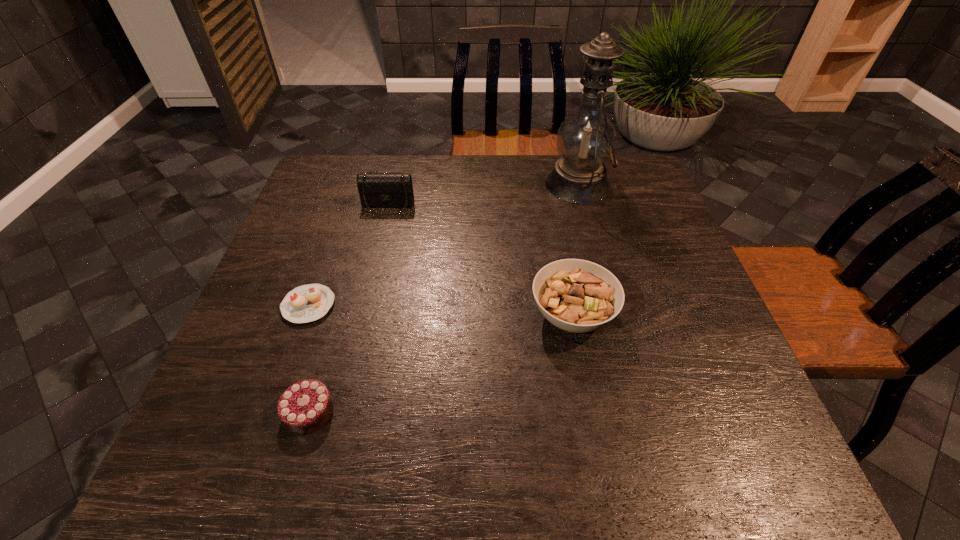
In the image, there is a desktop. Where is `free space at the near edge`? free space at the near edge is located at coordinates (414, 467).

Where is `vacant space at the left edge of the desktop`? This screenshot has width=960, height=540. vacant space at the left edge of the desktop is located at coordinates (253, 373).

Where is `vacant area at the right edge`? Image resolution: width=960 pixels, height=540 pixels. vacant area at the right edge is located at coordinates (639, 231).

The width and height of the screenshot is (960, 540). What are the coordinates of `vacant space at the far right corner of the desktop` in the screenshot? It's located at (647, 178).

Identify the location of blank region between the shortest object and the stew. Image resolution: width=960 pixels, height=540 pixels. [x=441, y=310].

Locate an element on the screen. The height and width of the screenshot is (540, 960). vacant area that lies between the cupcake and the clutch bag is located at coordinates (348, 255).

Where is `vacant space that's between the stew and the oil lamp`? vacant space that's between the stew and the oil lamp is located at coordinates (575, 250).

Find the location of a particular element. This screenshot has height=540, width=960. vacant point located between the shortest object and the nearest object is located at coordinates (309, 359).

Image resolution: width=960 pixels, height=540 pixels. I want to click on unoccupied area between the clutch bag and the tallest object, so [483, 195].

Identify the location of empty location between the second shortest object and the tallest object. (444, 298).